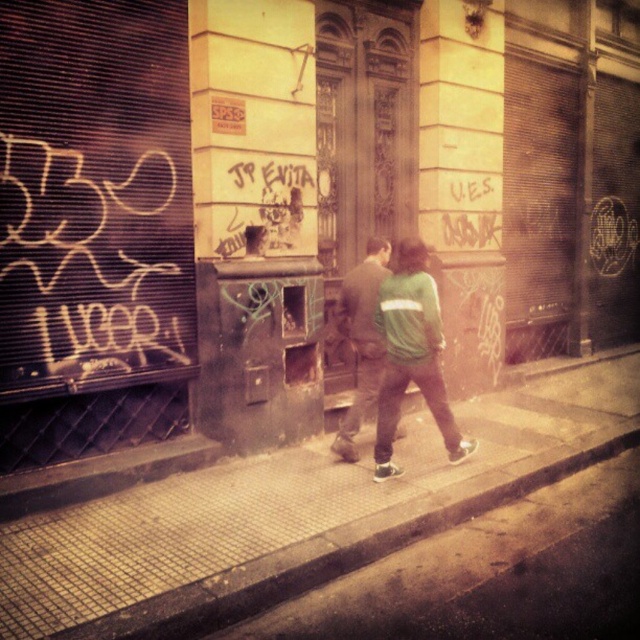
Question: Is smooth concrete sidewalk at center thinner than green fabric jacket at center?

Choices:
 (A) no
 (B) yes

Answer: (B)

Question: Which point is farther to the camera?

Choices:
 (A) green fabric jacket at center
 (B) smooth concrete sidewalk at center

Answer: (A)

Question: Which point is farther to the camera?

Choices:
 (A) (202, 531)
 (B) (362, 289)

Answer: (B)

Question: Is smooth concrete sidewalk at center positioned before green fabric jacket at center?

Choices:
 (A) no
 (B) yes

Answer: (B)

Question: Does smooth concrete sidewalk at center have a greater width compared to green fabric jacket at center?

Choices:
 (A) no
 (B) yes

Answer: (A)

Question: Which of the following is the farthest from the observer?

Choices:
 (A) (369, 384)
 (B) (115, 605)

Answer: (A)